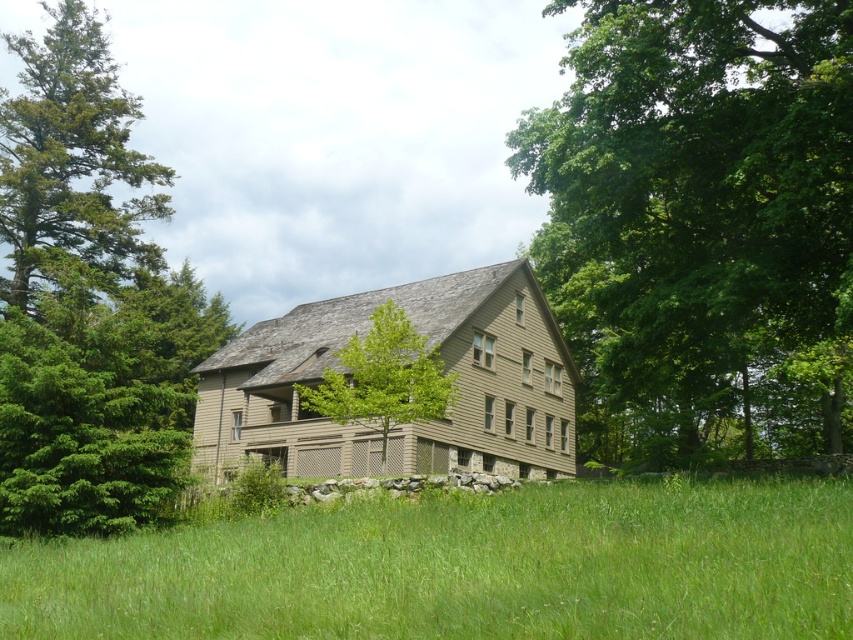
Does point (30, 432) come closer to viewer compared to point (21, 200)?

Yes, point (30, 432) is in front of point (21, 200).

Between green leafy tree at left and green coniferous tree at left, which one has less height?

green leafy tree at left is shorter.

Between point (136, 228) and point (141, 205), which one is positioned in front?

Point (136, 228) is more forward.

Identify the location of green leafy tree at left. (88, 300).

Describe the element at coordinates (701, 227) in the screenshot. I see `green leafy tree at upper right` at that location.

Can you confirm if green leafy tree at upper right is bigger than green coniferous tree at left?

Actually, green leafy tree at upper right might be smaller than green coniferous tree at left.

Which is in front, point (569, 310) or point (64, 220)?

Positioned in front is point (64, 220).

You are a GUI agent. You are given a task and a screenshot of the screen. Output one action in this format:
    pyautogui.click(x=<x>, y=<y>)
    Task: Click on the green leafy tree at upper right
    The width and height of the screenshot is (853, 640).
    Given the screenshot: What is the action you would take?
    pyautogui.click(x=701, y=227)

From the picture: Does green leafy tree at upper right have a smaller size compared to green leafy tree at center?

No.

Describe the element at coordinates (701, 227) in the screenshot. This screenshot has height=640, width=853. I see `green leafy tree at upper right` at that location.

Where is `green leafy tree at upper right`? This screenshot has height=640, width=853. green leafy tree at upper right is located at coordinates (701, 227).